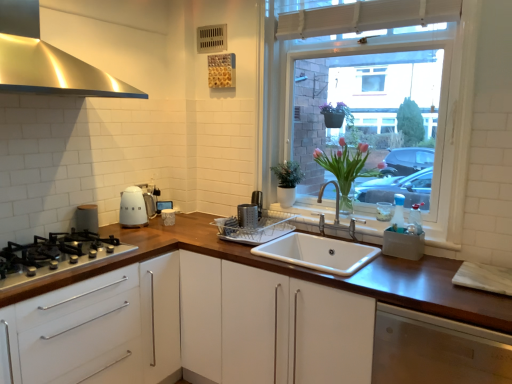
Question: Is stainless steel range hood at upper left at the left side of white ceramic sink at center?

Choices:
 (A) yes
 (B) no

Answer: (A)

Question: From a real-world perspective, is stainless steel range hood at upper left located higher than white ceramic sink at center?

Choices:
 (A) no
 (B) yes

Answer: (B)

Question: Are stainless steel range hood at upper left and white ceramic sink at center far apart?

Choices:
 (A) no
 (B) yes

Answer: (B)

Question: From a real-world perspective, is stainless steel range hood at upper left under white ceramic sink at center?

Choices:
 (A) yes
 (B) no

Answer: (B)

Question: Does stainless steel range hood at upper left contain white ceramic sink at center?

Choices:
 (A) no
 (B) yes

Answer: (A)

Question: From a real-world perspective, is pink glass vase at center physically located above or below white ceramic sink at center?

Choices:
 (A) below
 (B) above

Answer: (B)

Question: Considering their positions, is pink glass vase at center located in front of or behind white ceramic sink at center?

Choices:
 (A) behind
 (B) front

Answer: (A)

Question: Is pink glass vase at center bigger or smaller than white ceramic sink at center?

Choices:
 (A) big
 (B) small

Answer: (B)

Question: Is point (344, 196) closer or farther from the camera than point (342, 258)?

Choices:
 (A) farther
 (B) closer

Answer: (A)

Question: Based on their sizes in the image, would you say white glass window at upper right is bigger or smaller than pink glass vase at center?

Choices:
 (A) big
 (B) small

Answer: (A)

Question: Is white glass window at upper right situated inside pink glass vase at center or outside?

Choices:
 (A) inside
 (B) outside

Answer: (B)

Question: Is point click(x=371, y=104) closer or farther from the camera than point click(x=340, y=172)?

Choices:
 (A) closer
 (B) farther

Answer: (B)

Question: From the image's perspective, is white glass window at upper right positioned above or below pink glass vase at center?

Choices:
 (A) above
 (B) below

Answer: (A)

Question: From the image's perspective, is white ceramic sink at center positioned above or below dark brown wood at lower right, the 2th cabinetry when ordered from left to right?

Choices:
 (A) above
 (B) below

Answer: (A)

Question: Considering their positions, is white ceramic sink at center located in front of or behind dark brown wood at lower right, which is the 1th cabinetry in right-to-left order?

Choices:
 (A) behind
 (B) front

Answer: (A)